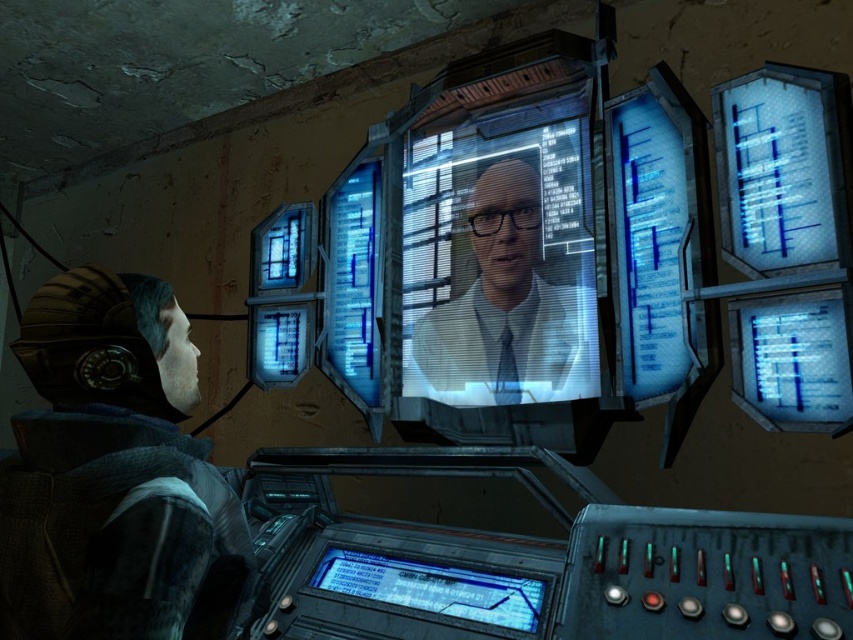
Between camouflage jacket at left and blue transparent display at bottom center, which one has more height?

With more height is camouflage jacket at left.

Measure the distance between point [224,524] and camera.

Point [224,524] and camera are 36.26 inches apart from each other.

This screenshot has height=640, width=853. What are the coordinates of `camouflage jacket at left` in the screenshot? It's located at (115, 476).

You are a GUI agent. You are given a task and a screenshot of the screen. Output one action in this format:
    pyautogui.click(x=<x>, y=<y>)
    Task: Click on the camouflage jacket at left
    The image size is (853, 640).
    Given the screenshot: What is the action you would take?
    pyautogui.click(x=115, y=476)

Is camouflage jacket at left taller than matte white shirt at center?

No.

Does point (173, 372) come in front of point (506, 170)?

Yes, point (173, 372) is closer to viewer.

The image size is (853, 640). I want to click on camouflage jacket at left, so click(115, 476).

Can you confirm if matte white shirt at center is positioned below blue transparent display at bottom center?

No, matte white shirt at center is not below blue transparent display at bottom center.

Who is shorter, matte white shirt at center or blue transparent display at bottom center?

Standing shorter between the two is blue transparent display at bottom center.

Who is more forward, (566,321) or (383,596)?

Point (383,596)

Locate an element on the screen. The width and height of the screenshot is (853, 640). matte white shirt at center is located at coordinates click(x=508, y=308).